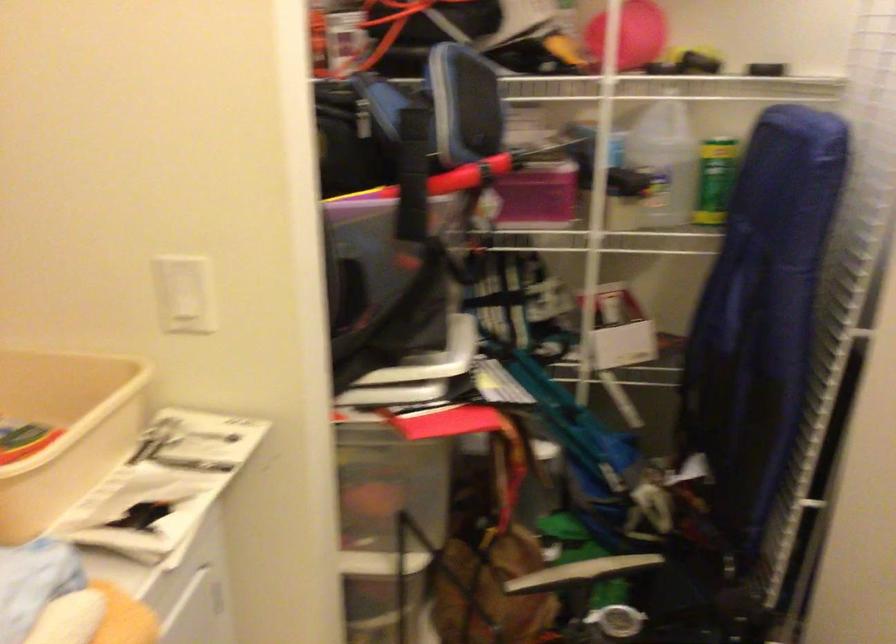
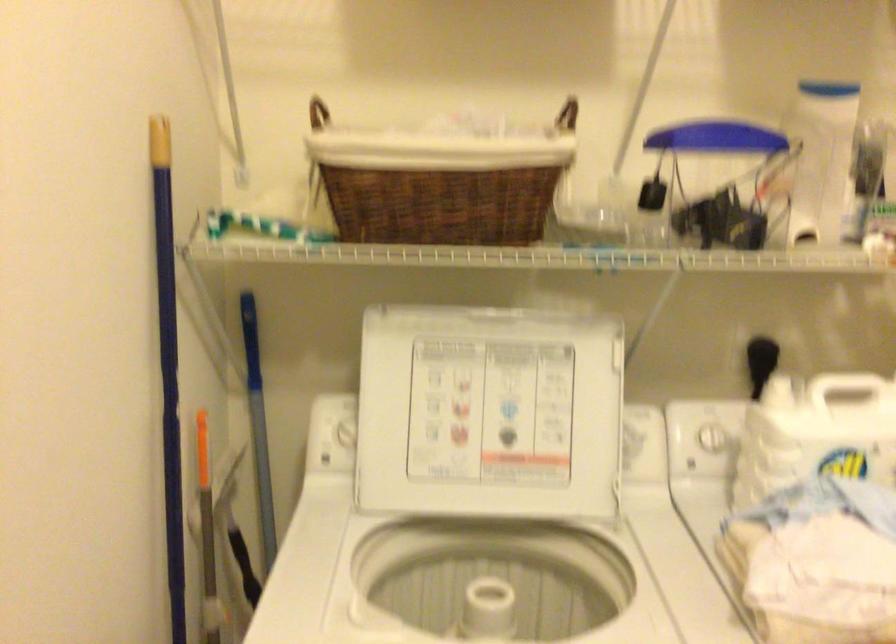
Question: Based on the continuous images, in which direction is the camera rotating? Reply with the corresponding letter.

Choices:
 (A) Left
 (B) Right
 (C) Up
 (D) Down

Answer: (A)